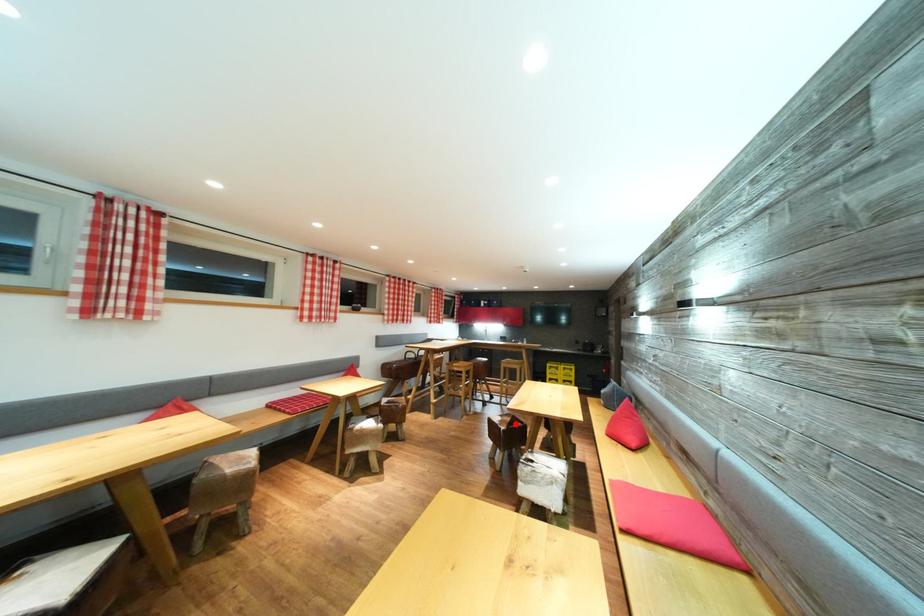
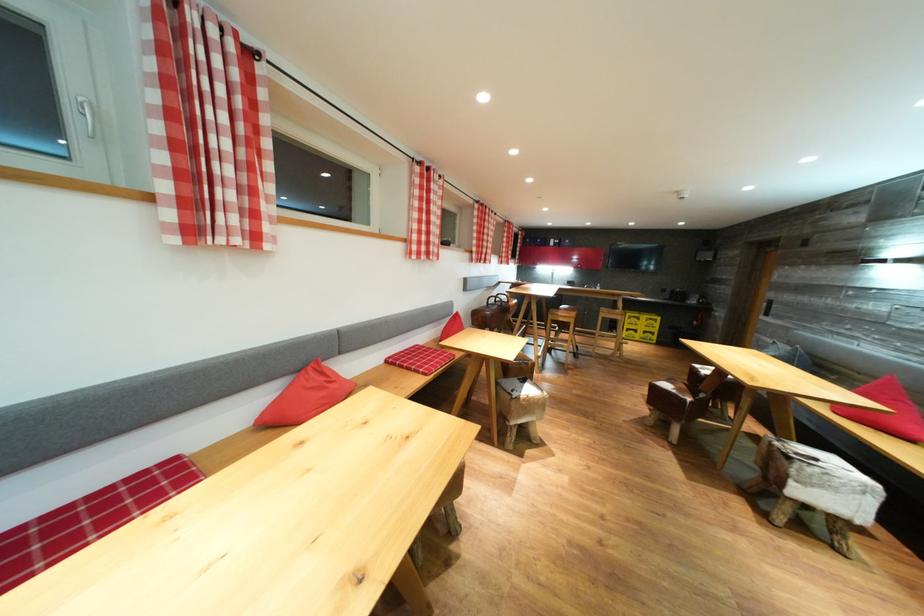
The point at the highlighted location is marked in the first image. Where is the corresponding point in the second image?

(689, 392)